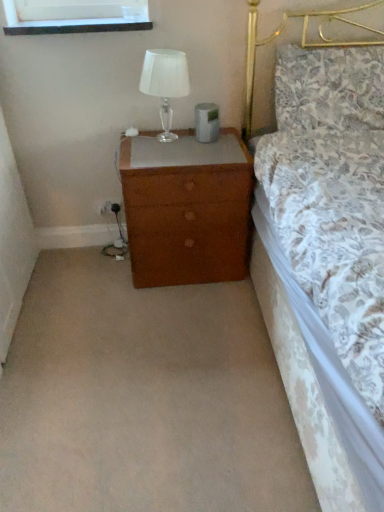
Question: Considering the positions of floral fabric pillow at upper right and brown wood nightstand at lower center in the image, is floral fabric pillow at upper right bigger or smaller than brown wood nightstand at lower center?

Choices:
 (A) small
 (B) big

Answer: (A)

Question: Is floral fabric pillow at upper right wider or thinner than brown wood nightstand at lower center?

Choices:
 (A) wide
 (B) thin

Answer: (B)

Question: Which object is positioned closest to the clear glass table lamp at upper right?

Choices:
 (A) brown wood nightstand at lower center
 (B) brown wood chest of drawers at center
 (C) floral fabric pillow at upper right

Answer: (B)

Question: Which object is positioned farthest from the clear glass table lamp at upper right?

Choices:
 (A) floral fabric pillow at upper right
 (B) brown wood nightstand at lower center
 (C) brown wood chest of drawers at center

Answer: (B)